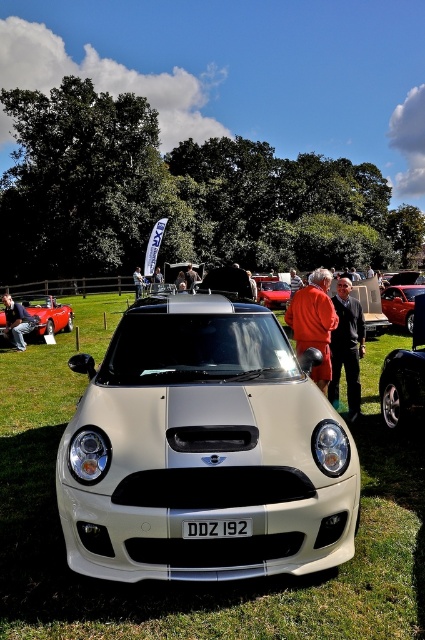
Question: Based on their relative distances, which object is farther from the orange fabric jacket at center?

Choices:
 (A) shiny red car at right
 (B) matte black car at center
 (C) white matte car at center

Answer: (A)

Question: Based on their relative distances, which object is farther from the denim jacket at lower left?

Choices:
 (A) dark brown leather jacket at center
 (B) orange fabric coat at center

Answer: (A)

Question: Based on their relative distances, which object is farther from the white matte car at center?

Choices:
 (A) white plastic license plate at center
 (B) orange fabric coat at center
 (C) white matte mini cooper at center

Answer: (A)

Question: Does matte black car at center have a smaller size compared to shiny red car at center?

Choices:
 (A) no
 (B) yes

Answer: (A)

Question: Does orange fabric coat at center lie behind shiny red car at center?

Choices:
 (A) no
 (B) yes

Answer: (A)

Question: Is white matte car at center bigger than orange fabric jacket at center?

Choices:
 (A) no
 (B) yes

Answer: (A)